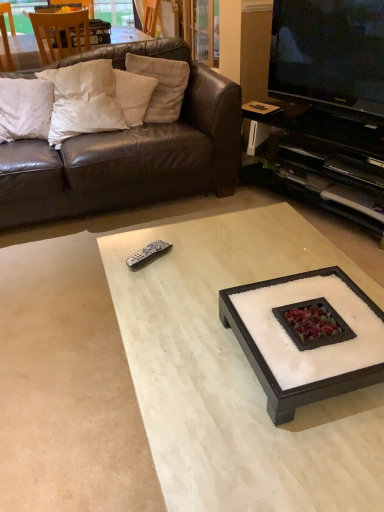
What do you see at coordinates (308, 341) in the screenshot? Image resolution: width=384 pixels, height=512 pixels. I see `white marble coffee table at center, which is the second coffee table in bottom-to-top order` at bounding box center [308, 341].

Describe the element at coordinates (61, 34) in the screenshot. I see `wooden chair at upper left` at that location.

Where is `brown leather couch at upper left`? This screenshot has width=384, height=512. brown leather couch at upper left is located at coordinates (129, 152).

Where is `black plastic cabinet at right`? The width and height of the screenshot is (384, 512). black plastic cabinet at right is located at coordinates click(x=329, y=162).

Describe the element at coordinates (84, 117) in the screenshot. I see `white soft pillow at upper left, the second pillow viewed from the left` at that location.

Describe the element at coordinates (133, 95) in the screenshot. Image resolution: width=384 pixels, height=512 pixels. I see `white soft pillow at upper left, arranged as the 3th pillow when viewed from the left` at that location.

Locate an element on the screen. Image resolution: width=384 pixels, height=512 pixels. white marble coffee table at center, which is the second coffee table in bottom-to-top order is located at coordinates (308, 341).

Can you tell me how much white soft pillow at upper left, the 1th pillow viewed from the left, and wooden chair at upper left differ in facing direction?

The facing directions of white soft pillow at upper left, the 1th pillow viewed from the left, and wooden chair at upper left are 174 degrees apart.

In the image, is white soft pillow at upper left, the fourth pillow viewed from the right, positioned in front of or behind wooden chair at upper left?

In the image, white soft pillow at upper left, the fourth pillow viewed from the right, appears in front of wooden chair at upper left.

From the wooden chair at upper left, count 3rd pillows forward and point to it. Please provide its 2D coordinates.

[(25, 109)]

From a real-world perspective, is white soft pillow at upper left, the fourth pillow viewed from the right, physically above wooden chair at upper left?

Incorrect, from a real-world perspective, white soft pillow at upper left, the fourth pillow viewed from the right, is lower than wooden chair at upper left.

Considering the points (309, 223) and (160, 97), which point is behind, point (309, 223) or point (160, 97)?

The point (160, 97) is farther from the camera.

Is white marble coffee table at center, which is the 1th coffee table in bottom-to-top order, smaller than white cotton pillow at upper left, which is the fourth pillow in left-to-right order?

Incorrect, white marble coffee table at center, which is the 1th coffee table in bottom-to-top order, is not smaller in size than white cotton pillow at upper left, which is the fourth pillow in left-to-right order.

From a real-world perspective, which is physically below, white marble coffee table at center, which is the 1th coffee table in bottom-to-top order, or white cotton pillow at upper left, the first pillow when ordered from right to left?

From a 3D spatial view, white marble coffee table at center, which is the 1th coffee table in bottom-to-top order, is below.

Is white marble coffee table at center, which is the 1th coffee table in bottom-to-top order, with white cotton pillow at upper left, the first pillow when ordered from right to left?

No, white marble coffee table at center, which is the 1th coffee table in bottom-to-top order, is not touching white cotton pillow at upper left, the first pillow when ordered from right to left.

Between white soft pillow at upper left, which ranks as the 3th pillow in right-to-left order, and white marble coffee table at center, which is the second coffee table in bottom-to-top order, which one has smaller size?

With smaller size is white marble coffee table at center, which is the second coffee table in bottom-to-top order.

Considering the relative positions of white soft pillow at upper left, the second pillow viewed from the left, and white marble coffee table at center, acting as the first coffee table starting from the top, in the image provided, is white soft pillow at upper left, the second pillow viewed from the left, behind white marble coffee table at center, acting as the first coffee table starting from the top,?

Yes, the depth of white soft pillow at upper left, the second pillow viewed from the left, is greater than that of white marble coffee table at center, acting as the first coffee table starting from the top.

Considering the positions of point (84, 100) and point (293, 371), is point (84, 100) closer or farther from the camera than point (293, 371)?

Clearly, point (84, 100) is more distant from the camera than point (293, 371).

Between white soft pillow at upper left, which ranks as the 3th pillow in right-to-left order, and white marble coffee table at center, acting as the first coffee table starting from the top, which one has smaller width?

Thinner between the two is white marble coffee table at center, acting as the first coffee table starting from the top.

Looking at this image, can you confirm if black plastic cabinet at right is shorter than white marble coffee table at center, which is the second coffee table in bottom-to-top order?

No.

Who is more distant, black plastic cabinet at right or white marble coffee table at center, which is the second coffee table in bottom-to-top order?

black plastic cabinet at right is further from the camera.

Is black plastic cabinet at right bigger or smaller than white marble coffee table at center, which is the second coffee table in bottom-to-top order?

Clearly, black plastic cabinet at right is larger in size than white marble coffee table at center, which is the second coffee table in bottom-to-top order.

Which point is more forward, (x=272, y=137) or (x=359, y=352)?

The point (x=359, y=352) is in front.

Between white soft pillow at upper left, the fourth pillow viewed from the right, and black plastic cabinet at right, which one has more height?

Standing taller between the two is black plastic cabinet at right.

Looking at this image, between white soft pillow at upper left, the 1th pillow viewed from the left, and black plastic cabinet at right, which one has smaller width?

Thinner between the two is white soft pillow at upper left, the 1th pillow viewed from the left.

Looking at this image, from a real-world perspective, is white soft pillow at upper left, the 1th pillow viewed from the left, located higher than black plastic cabinet at right?

Yes, from a real-world perspective, white soft pillow at upper left, the 1th pillow viewed from the left, is on top of black plastic cabinet at right.

Who is more distant, white soft pillow at upper left, the 1th pillow viewed from the left, or black plastic cabinet at right?

white soft pillow at upper left, the 1th pillow viewed from the left, is behind.

Would you say white marble coffee table at center, positioned as the 2th coffee table in top-to-bottom order, is to the left or to the right of white soft pillow at upper left, the fourth pillow viewed from the right, in the picture?

From the image, it's evident that white marble coffee table at center, positioned as the 2th coffee table in top-to-bottom order, is to the right of white soft pillow at upper left, the fourth pillow viewed from the right.

Is white marble coffee table at center, which is the 1th coffee table in bottom-to-top order, oriented away from white soft pillow at upper left, the fourth pillow viewed from the right?

No.

Looking at this image, is white marble coffee table at center, which is the 1th coffee table in bottom-to-top order, behind white soft pillow at upper left, the 1th pillow viewed from the left?

No, it is in front of white soft pillow at upper left, the 1th pillow viewed from the left.

Based on the photo, from the image's perspective, is white marble coffee table at center, positioned as the 2th coffee table in top-to-bottom order, on top of white soft pillow at upper left, the 1th pillow viewed from the left?

No, from the image's perspective, white marble coffee table at center, positioned as the 2th coffee table in top-to-bottom order, is not over white soft pillow at upper left, the 1th pillow viewed from the left.

Based on the photo, from the image's perspective, relative to black glossy television at upper right, is white marble coffee table at center, acting as the first coffee table starting from the top, above or below?

Based on their image positions, white marble coffee table at center, acting as the first coffee table starting from the top, is located beneath black glossy television at upper right.

Is white marble coffee table at center, which is the second coffee table in bottom-to-top order, with black glossy television at upper right?

white marble coffee table at center, which is the second coffee table in bottom-to-top order, is not next to black glossy television at upper right, and they're not touching.

Could you tell me if white marble coffee table at center, acting as the first coffee table starting from the top, is facing black glossy television at upper right?

No, white marble coffee table at center, acting as the first coffee table starting from the top, is not turned towards black glossy television at upper right.

From the wooden chair at upper left, count 1st pillow to the right and point to it. Please provide its 2D coordinates.

[(25, 109)]

Which pillow is the 1st one when counting from the left side of the white marble coffee table at center, which is the 1th coffee table in bottom-to-top order? Please provide its 2D coordinates.

[(161, 85)]

Considering their positions, is black glossy television at upper right positioned further to black plastic cabinet at right than white soft pillow at upper left, the second pillow viewed from the left?

The object further to black plastic cabinet at right is white soft pillow at upper left, the second pillow viewed from the left.

In the scene shown: Estimate the real-world distances between objects in this image. Which object is closer to white soft pillow at upper left, the 1th pillow viewed from the left, black glossy television at upper right or white soft pillow at upper left, the second pillow viewed from the left?

white soft pillow at upper left, the second pillow viewed from the left, is closer to white soft pillow at upper left, the 1th pillow viewed from the left.

Based on their spatial positions, is white marble coffee table at center, which is the second coffee table in bottom-to-top order, or black glossy television at upper right closer to brown leather couch at upper left?

black glossy television at upper right is closer to brown leather couch at upper left.

Which object lies further to the anchor point white marble coffee table at center, which is the 1th coffee table in bottom-to-top order, white cotton pillow at upper left, which is the fourth pillow in left-to-right order, or wooden chair at upper left?

wooden chair at upper left.

Considering their positions, is brown leather couch at upper left positioned closer to black glossy television at upper right than white soft pillow at upper left, acting as the second pillow starting from the right?

The object closer to black glossy television at upper right is brown leather couch at upper left.

When comparing their distances from white marble coffee table at center, acting as the first coffee table starting from the top, does black glossy television at upper right or white soft pillow at upper left, which ranks as the 3th pillow in right-to-left order, seem closer?

Based on the image, black glossy television at upper right appears to be nearer to white marble coffee table at center, acting as the first coffee table starting from the top.

Which object lies nearer to the anchor point white marble coffee table at center, which is the second coffee table in bottom-to-top order, white soft pillow at upper left, the fourth pillow viewed from the right, or black glossy television at upper right?

black glossy television at upper right lies closer to white marble coffee table at center, which is the second coffee table in bottom-to-top order, than the other object.

Based on their spatial positions, is white marble coffee table at center, positioned as the 2th coffee table in top-to-bottom order, or black plastic cabinet at right further from white soft pillow at upper left, the 1th pillow viewed from the left?

white marble coffee table at center, positioned as the 2th coffee table in top-to-bottom order, lies further to white soft pillow at upper left, the 1th pillow viewed from the left, than the other object.

Find the location of a particular element. The image size is (384, 512). pillow between wooden chair at upper left and white soft pillow at upper left, acting as the second pillow starting from the right, vertically is located at coordinates (161, 85).

This screenshot has height=512, width=384. I want to click on television between white marble coffee table at center, positioned as the 2th coffee table in top-to-bottom order, and white cotton pillow at upper left, the first pillow when ordered from right to left, in the front-back direction, so click(x=330, y=56).

You are a GUI agent. You are given a task and a screenshot of the screen. Output one action in this format:
    pyautogui.click(x=<x>, y=<y>)
    Task: Click on the coffee table between white marble coffee table at center, which is the 1th coffee table in bottom-to-top order, and brown leather couch at upper left in the front-back direction
    Image resolution: width=384 pixels, height=512 pixels.
    Given the screenshot: What is the action you would take?
    pyautogui.click(x=308, y=341)

In order to click on television between white marble coffee table at center, acting as the first coffee table starting from the top, and white soft pillow at upper left, which ranks as the 3th pillow in right-to-left order, in the front-back direction in this screenshot , I will do `click(330, 56)`.